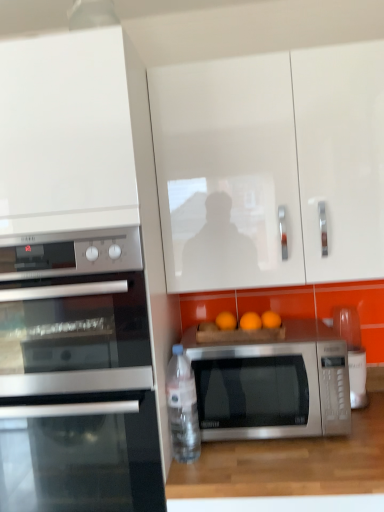
This screenshot has height=512, width=384. What are the coordinates of `vacant space in front of clear plastic bottle at lower center` in the screenshot? It's located at (187, 473).